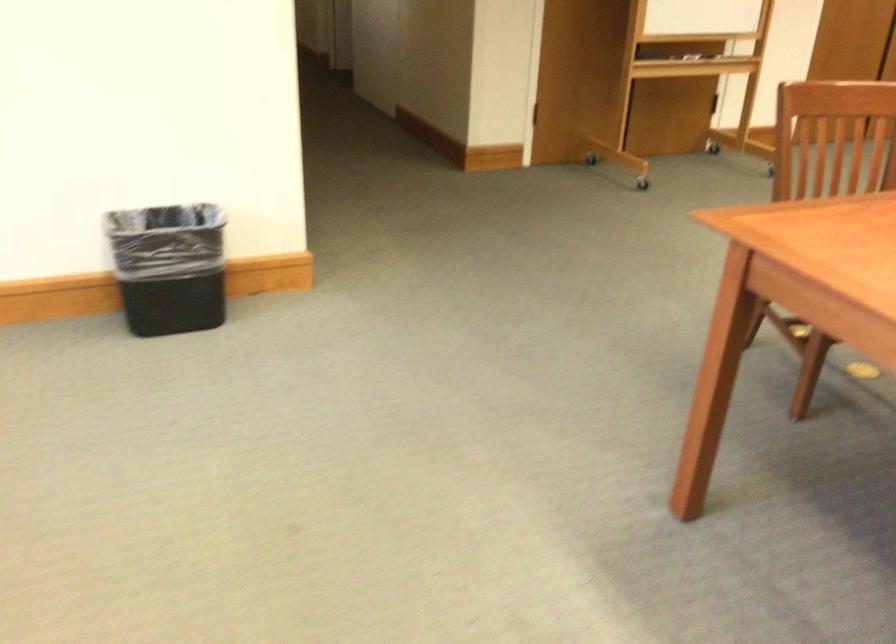
What do you see at coordinates (849, 220) in the screenshot? This screenshot has height=644, width=896. I see `the chair sitting surface` at bounding box center [849, 220].